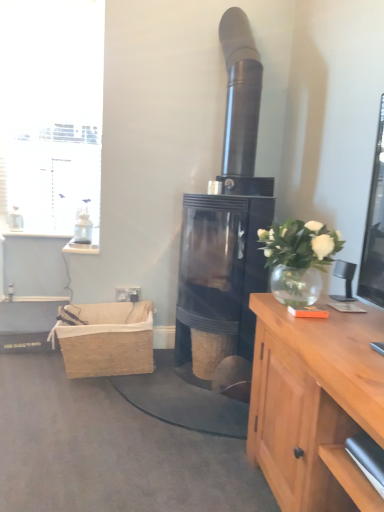
Where is `free location to the left of burlap picnic basket at lower left`? Image resolution: width=384 pixels, height=512 pixels. free location to the left of burlap picnic basket at lower left is located at coordinates point(31,368).